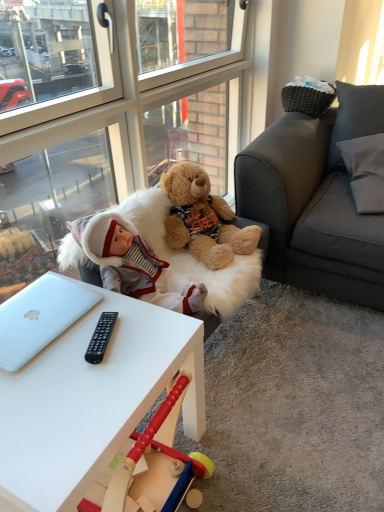
Where is `fluffy brown teddy bear at center`? fluffy brown teddy bear at center is located at coordinates (203, 219).

What do you see at coordinates (40, 317) in the screenshot? I see `silver metallic laptop at lower left` at bounding box center [40, 317].

Measure the distance between point (x=32, y=283) and camera.

The distance of point (x=32, y=283) from camera is 1.29 meters.

Measure the distance between white fur swivel chair at center and camera.

white fur swivel chair at center is 1.28 meters from camera.

In order to click on white fur swivel chair at center in this screenshot , I will do `click(157, 258)`.

This screenshot has width=384, height=512. Describe the element at coordinates (365, 170) in the screenshot. I see `white fabric pillow at upper right` at that location.

In order to click on fluffy brown teddy bear at center in this screenshot , I will do `click(203, 219)`.

Between white matte desk at center and transparent glass door at upper left, which one has more height?

With more height is transparent glass door at upper left.

From the picture: Can you confirm if white matte desk at center is thinner than transparent glass door at upper left?

No.

From the image's perspective, is white matte desk at center on top of transparent glass door at upper left?

No, from the image's perspective, white matte desk at center is not over transparent glass door at upper left.

Is white matte desk at center inside or outside of transparent glass door at upper left?

white matte desk at center exists outside the volume of transparent glass door at upper left.

Is white fabric pillow at upper right surrounded by white matte desk at center?

Actually, white fabric pillow at upper right is outside white matte desk at center.

Would you say white matte desk at center is a long distance from white fabric pillow at upper right?

Absolutely, white matte desk at center is distant from white fabric pillow at upper right.

From the image's perspective, which is above, white matte desk at center or white fabric pillow at upper right?

white fabric pillow at upper right.

Considering the positions of objects white matte desk at center and white fabric pillow at upper right in the image provided, who is more to the left, white matte desk at center or white fabric pillow at upper right?

From the viewer's perspective, white matte desk at center appears more on the left side.

Does point (169, 65) appear closer or farther from the camera than point (67, 249)?

Point (169, 65) is positioned farther from the camera compared to point (67, 249).

From a real-world perspective, who is located higher, transparent glass door at upper left or white fur swivel chair at center?

In real-world perspective, transparent glass door at upper left is above.

Is white fur swivel chair at center at the back of transparent glass door at upper left?

Yes.

Looking at this image, what's the angular difference between transparent glass door at upper left and white fur swivel chair at center's facing directions?

They differ by 3.87 degrees in their facing directions.

This screenshot has width=384, height=512. What are the coordinates of `swivel chair below the transparent glass door at upper left (from the image's perspective)` in the screenshot? It's located at (157, 258).

Does point (183, 263) appear closer or farther from the camera than point (86, 186)?

Point (183, 263).

Choose the correct answer: Is white fur swivel chair at center inside transparent glass door at upper left or outside it?

white fur swivel chair at center is not inside transparent glass door at upper left, it's outside.

Is white fur swivel chair at center closer to camera compared to transparent glass door at upper left?

That is False.

From a real-world perspective, who is located higher, silver metallic laptop at lower left or white fabric pillow at upper right?

In real-world perspective, white fabric pillow at upper right is above.

From the image's perspective, which object appears higher, silver metallic laptop at lower left or white fabric pillow at upper right?

white fabric pillow at upper right appears higher in the image.

From their relative heights in the image, would you say silver metallic laptop at lower left is taller or shorter than white fabric pillow at upper right?

Considering their sizes, silver metallic laptop at lower left has less height than white fabric pillow at upper right.

Can you tell me how much silver metallic laptop at lower left and white fabric pillow at upper right differ in facing direction?

silver metallic laptop at lower left and white fabric pillow at upper right are facing 68.3 degrees away from each other.

Considering the sizes of objects silver metallic laptop at lower left and white matte desk at center in the image provided, who is smaller, silver metallic laptop at lower left or white matte desk at center?

silver metallic laptop at lower left.

Can you see silver metallic laptop at lower left touching white matte desk at center?

They are not placed beside each other.

What's the angular difference between silver metallic laptop at lower left and white matte desk at center's facing directions?

0.108 degrees separate the facing orientations of silver metallic laptop at lower left and white matte desk at center.

Is silver metallic laptop at lower left facing towards white matte desk at center?

Yes, silver metallic laptop at lower left is aimed at white matte desk at center.

From the image's perspective, relative to white fur swivel chair at center, is white matte desk at center above or below?

From the image's perspective, white matte desk at center appears below white fur swivel chair at center.

Between white matte desk at center and white fur swivel chair at center, which one appears on the left side from the viewer's perspective?

white matte desk at center is more to the left.

Would you say white matte desk at center contains white fur swivel chair at center?

Actually, white fur swivel chair at center is outside white matte desk at center.

I want to click on desk that is under the transparent glass door at upper left (from a real-world perspective), so click(90, 400).

Find the location of a particular element. This screenshot has height=512, width=384. pillow behind the white matte desk at center is located at coordinates (365, 170).

Estimate the real-world distances between objects in this image. Which object is further from white fur swivel chair at center, silver metallic laptop at lower left or white matte desk at center?

white matte desk at center is further to white fur swivel chair at center.

From the image, which object appears to be farther from white matte desk at center, fluffy brown teddy bear at center or white fur swivel chair at center?

Based on the image, fluffy brown teddy bear at center appears to be further to white matte desk at center.

Considering their positions, is white fabric pillow at upper right positioned further to white matte desk at center than transparent glass door at upper left?

Among the two, white fabric pillow at upper right is located further to white matte desk at center.

Which object lies nearer to the anchor point white matte desk at center, white fabric pillow at upper right or fluffy brown teddy bear at center?

The object closer to white matte desk at center is fluffy brown teddy bear at center.

From the image, which object appears to be farther from white fur swivel chair at center, white fabric pillow at upper right or silver metallic laptop at lower left?

Among the two, white fabric pillow at upper right is located further to white fur swivel chair at center.

Which object lies further to the anchor point white matte desk at center, fluffy brown teddy bear at center or transparent glass door at upper left?

transparent glass door at upper left lies further to white matte desk at center than the other object.

When comparing their distances from fluffy brown teddy bear at center, does white fabric pillow at upper right or white matte desk at center seem further?

white matte desk at center is further to fluffy brown teddy bear at center.

From the image, which object appears to be nearer to transparent glass door at upper left, fluffy brown teddy bear at center or white matte desk at center?

fluffy brown teddy bear at center is closer to transparent glass door at upper left.

Where is `swivel chair between white matte desk at center and fluffy brown teddy bear at center along the z-axis`? This screenshot has width=384, height=512. swivel chair between white matte desk at center and fluffy brown teddy bear at center along the z-axis is located at coordinates (157, 258).

This screenshot has width=384, height=512. I want to click on glass door between silver metallic laptop at lower left and white fabric pillow at upper right from left to right, so click(x=105, y=110).

The image size is (384, 512). I want to click on desk between silver metallic laptop at lower left and white fabric pillow at upper right from left to right, so click(x=90, y=400).

Image resolution: width=384 pixels, height=512 pixels. What are the coordinates of `teddy bear between transparent glass door at upper left and silver metallic laptop at lower left vertically` in the screenshot? It's located at (203, 219).